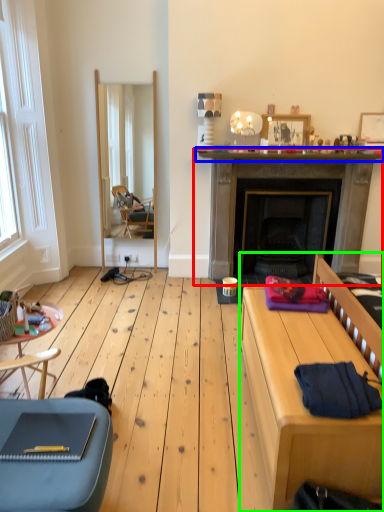
Question: Considering the real-world distances, which object is closest to fireplace (highlighted by a red box)? mantle (highlighted by a blue box) or bed frame (highlighted by a green box).

Choices:
 (A) mantle
 (B) bed frame

Answer: (A)